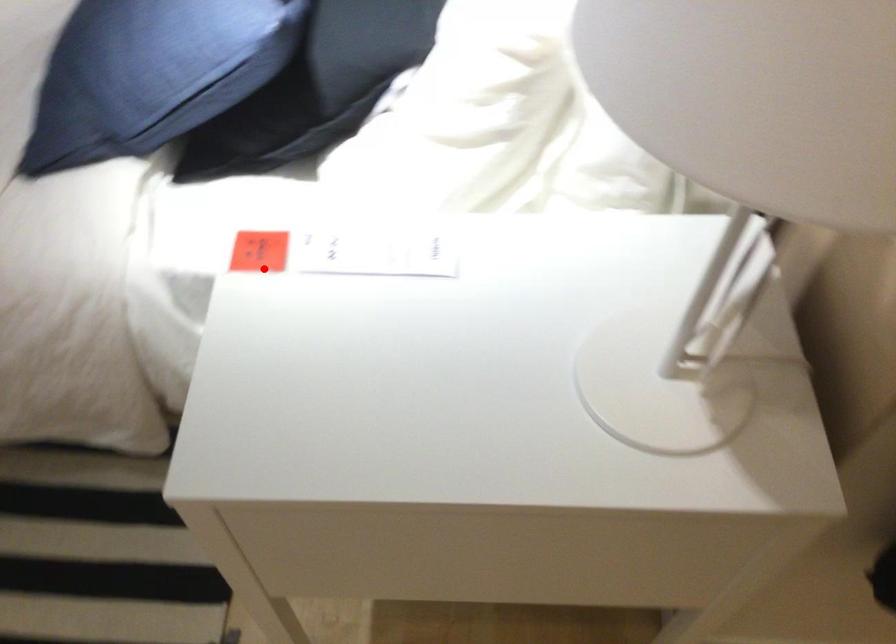
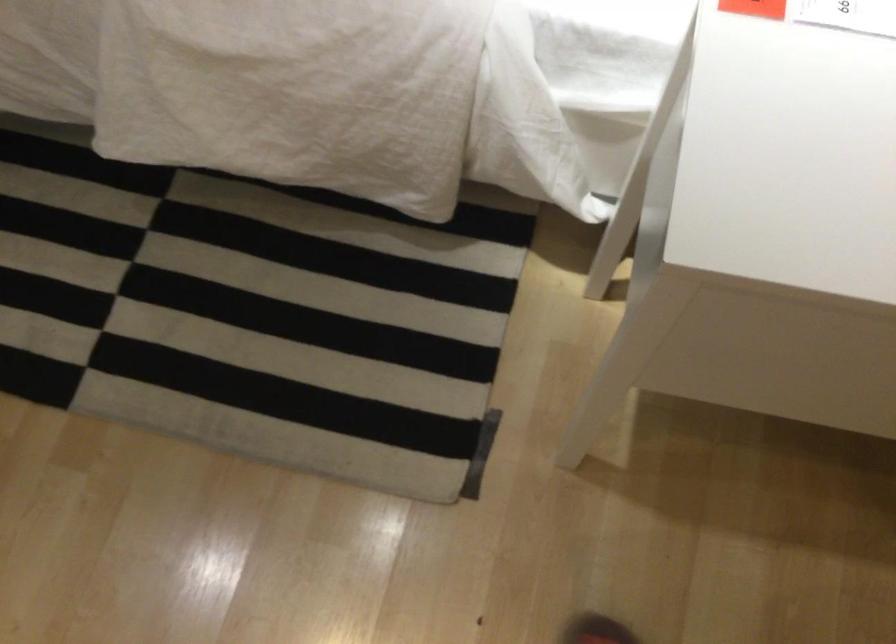
Question: I am providing you with two images of the same scene from different viewpoints. Image1 has a red point marked. In image2, the corresponding 3D location appears at what relative position? Reply with the corresponding letter.

Choices:
 (A) Closer
 (B) Farther

Answer: (A)